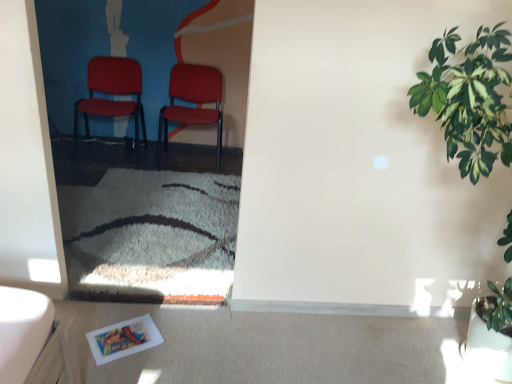
Question: Should I look upward or downward to see matte plastic chair at center, which is the 2th chair from right to left?

Choices:
 (A) down
 (B) up

Answer: (B)

Question: In which direction should I rotate to look at matte red chair at center, which is the second chair in left-to-right order?

Choices:
 (A) left
 (B) right

Answer: (A)

Question: Is matte plastic chair at center, which is the 2th chair from right to left, looking in the opposite direction of green leafy plant at right?

Choices:
 (A) yes
 (B) no

Answer: (B)

Question: Does matte plastic chair at center, which is the 2th chair from right to left, have a larger size compared to green leafy plant at right?

Choices:
 (A) yes
 (B) no

Answer: (B)

Question: Would you consider matte plastic chair at center, which is the 2th chair from right to left, to be distant from green leafy plant at right?

Choices:
 (A) yes
 (B) no

Answer: (A)

Question: From the image's perspective, would you say matte plastic chair at center, which ranks as the first chair in left-to-right order, is shown under green leafy plant at right?

Choices:
 (A) no
 (B) yes

Answer: (A)

Question: Is matte plastic chair at center, which ranks as the first chair in left-to-right order, outside green leafy plant at right?

Choices:
 (A) no
 (B) yes

Answer: (B)

Question: Is matte plastic chair at center, which is the 2th chair from right to left, further to camera compared to green leafy plant at right?

Choices:
 (A) yes
 (B) no

Answer: (A)

Question: Can you confirm if matte red chair at center, marked as the 1th chair in a right-to-left arrangement, is bigger than green leafy plant at right?

Choices:
 (A) no
 (B) yes

Answer: (A)

Question: Is matte red chair at center, which is the second chair in left-to-right order, outside green leafy plant at right?

Choices:
 (A) yes
 (B) no

Answer: (A)

Question: Is matte red chair at center, marked as the 1th chair in a right-to-left arrangement, beside green leafy plant at right?

Choices:
 (A) no
 (B) yes

Answer: (A)

Question: Is matte red chair at center, which is the second chair in left-to-right order, shorter than green leafy plant at right?

Choices:
 (A) no
 (B) yes

Answer: (B)

Question: From the image's perspective, is matte red chair at center, marked as the 1th chair in a right-to-left arrangement, located above green leafy plant at right?

Choices:
 (A) no
 (B) yes

Answer: (B)

Question: Is there a large distance between matte red chair at center, marked as the 1th chair in a right-to-left arrangement, and green leafy plant at right?

Choices:
 (A) no
 (B) yes

Answer: (B)

Question: Considering the relative sizes of green leafy plant at right and matte plastic chair at center, which ranks as the first chair in left-to-right order, in the image provided, is green leafy plant at right thinner than matte plastic chair at center, which ranks as the first chair in left-to-right order,?

Choices:
 (A) yes
 (B) no

Answer: (B)